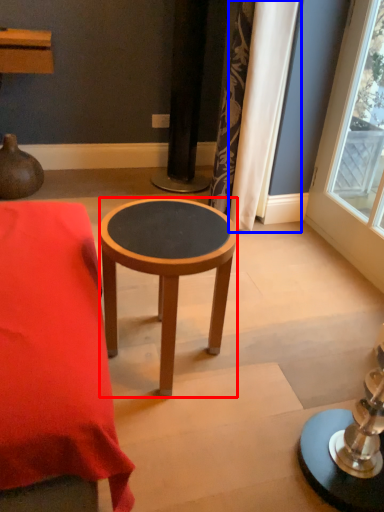
Question: Which point is further to the camera, stool (highlighted by a red box) or curtain (highlighted by a blue box)?

Choices:
 (A) stool
 (B) curtain

Answer: (B)